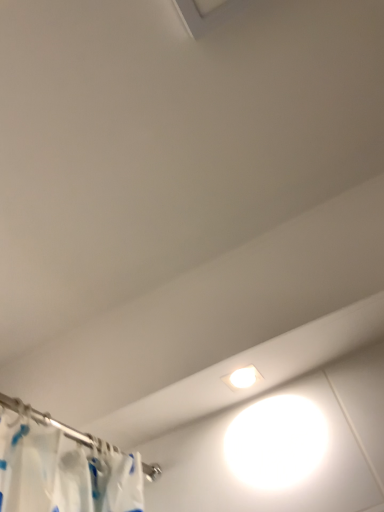
Locate an element on the screen. This screenshot has width=384, height=512. white plastic lamp at center is located at coordinates (243, 378).

This screenshot has height=512, width=384. What do you see at coordinates (243, 378) in the screenshot?
I see `white plastic lamp at center` at bounding box center [243, 378].

At what (x,y) coordinates should I click in order to perform the action: click on white plastic lamp at center. Please return your answer as a coordinate pair (x, y). The image size is (384, 512). Looking at the image, I should click on (243, 378).